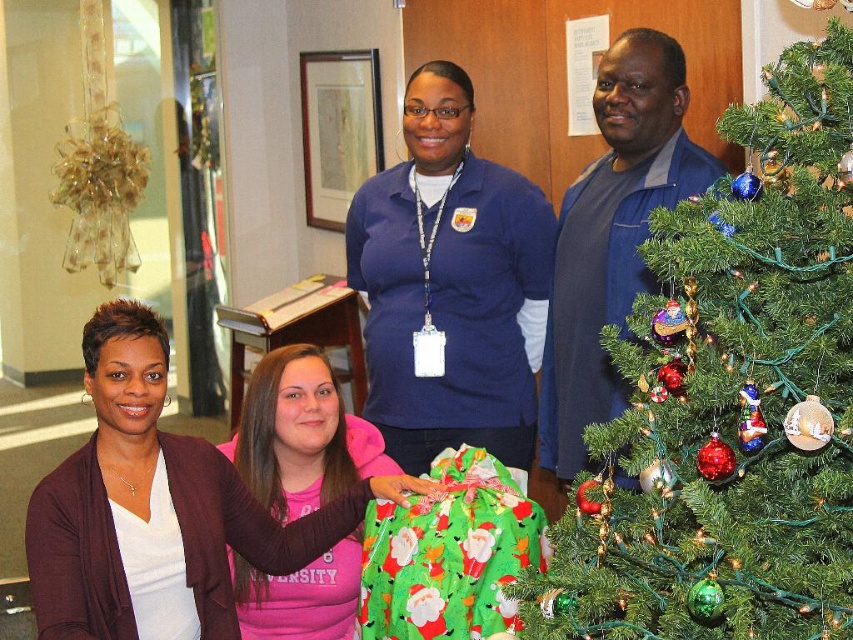
Which is more to the left, matte blue shirt at center or pink fabric shirt at center?

pink fabric shirt at center is more to the left.

Does matte blue shirt at center have a smaller size compared to pink fabric shirt at center?

Actually, matte blue shirt at center might be larger than pink fabric shirt at center.

Who is more distant from viewer, (473, 369) or (302, 352)?

The point (473, 369) is more distant.

You are a GUI agent. You are given a task and a screenshot of the screen. Output one action in this format:
    pyautogui.click(x=<x>, y=<y>)
    Task: Click on the matte blue shirt at center
    The width and height of the screenshot is (853, 640).
    Given the screenshot: What is the action you would take?
    pyautogui.click(x=450, y=284)

Is green textured christmas tree at right thinner than matte blue shirt at center?

Yes, green textured christmas tree at right is thinner than matte blue shirt at center.

Can you confirm if green textured christmas tree at right is taller than matte blue shirt at center?

No, green textured christmas tree at right is not taller than matte blue shirt at center.

Does point (827, 493) come closer to viewer compared to point (544, 234)?

Yes, point (827, 493) is in front of point (544, 234).

The height and width of the screenshot is (640, 853). In order to click on green textured christmas tree at right in this screenshot , I will do `click(729, 397)`.

Which of these two, green textured christmas tree at right or blue cotton shirt at center, stands shorter?

With less height is green textured christmas tree at right.

Which of these two, green textured christmas tree at right or blue cotton shirt at center, stands taller?

With more height is blue cotton shirt at center.

Which is in front, point (840, 320) or point (612, 131)?

Point (840, 320) is in front.

This screenshot has width=853, height=640. In order to click on green textured christmas tree at right in this screenshot , I will do `click(729, 397)`.